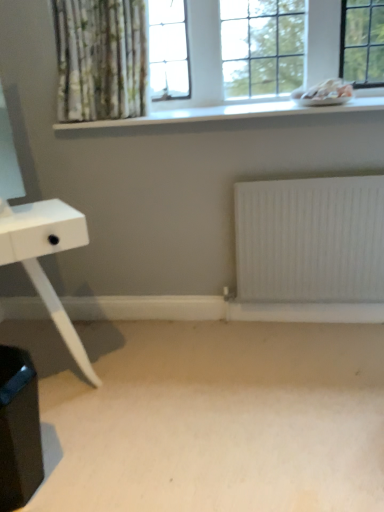
In order to click on vacant area located to the right-hand side of white matte table at left in this screenshot , I will do `click(162, 402)`.